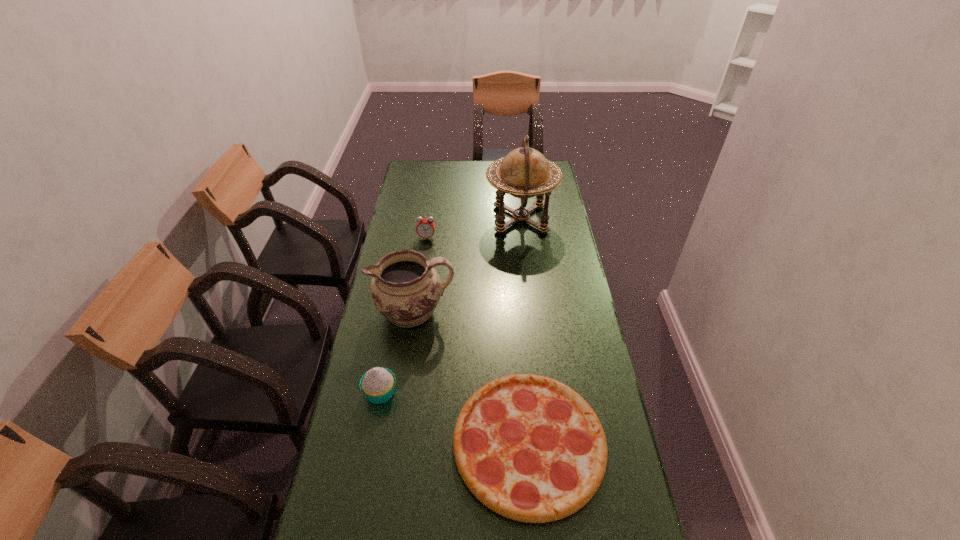
Find the location of a particular element. The image size is (960, 540). free location located on the front-facing side of the alarm clock is located at coordinates (421, 278).

Where is `vacant space located on the back of the pizza`? Image resolution: width=960 pixels, height=540 pixels. vacant space located on the back of the pizza is located at coordinates (520, 338).

The width and height of the screenshot is (960, 540). What are the coordinates of `pitcher that is at the left edge` in the screenshot? It's located at click(405, 288).

Where is `cupcake located in the left edge section of the desktop`? The height and width of the screenshot is (540, 960). cupcake located in the left edge section of the desktop is located at coordinates (378, 384).

In order to click on alarm clock at the left edge in this screenshot , I will do `click(425, 228)`.

You are a GUI agent. You are given a task and a screenshot of the screen. Output one action in this format:
    pyautogui.click(x=<x>, y=<y>)
    Task: Click on the globe that is at the right edge
    
    Given the screenshot: What is the action you would take?
    pyautogui.click(x=524, y=173)

The image size is (960, 540). In order to click on pizza located at the right edge in this screenshot , I will do `click(528, 447)`.

At what (x,y) coordinates should I click in order to perform the action: click on vacant space at the left edge of the desktop. Please return your answer as a coordinate pair (x, y). This screenshot has width=960, height=540. Looking at the image, I should click on (338, 507).

This screenshot has width=960, height=540. In order to click on vacant space at the right edge of the desktop in this screenshot , I will do `click(531, 218)`.

Image resolution: width=960 pixels, height=540 pixels. I want to click on unoccupied area between the pitcher and the shortest object, so click(471, 377).